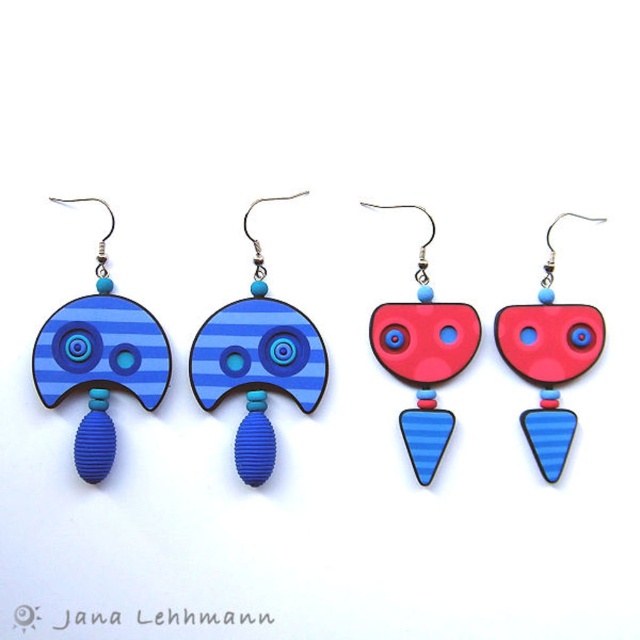
What do you see at coordinates (99, 358) in the screenshot? I see `matte blue wood earring at left` at bounding box center [99, 358].

Is point (109, 342) closer to camera compared to point (413, 381)?

That is True.

The image size is (640, 640). I want to click on matte blue wood earring at left, so click(99, 358).

Does blue striped wood at center have a lesser height compared to matte blue wood earring at center?

No.

Consider the image. Does blue striped wood at center have a greater width compared to matte blue wood earring at center?

Yes.

Locate an element on the screen. This screenshot has height=640, width=640. blue striped wood at center is located at coordinates (257, 362).

The image size is (640, 640). Identify the location of blue striped wood at center. tap(257, 362).

Does blue striped wood at center have a smaller size compared to matte red plastic heart at center?

Incorrect, blue striped wood at center is not smaller in size than matte red plastic heart at center.

Between point (241, 422) and point (545, 312), which one is positioned in front?

Point (241, 422) is more forward.

The width and height of the screenshot is (640, 640). In order to click on blue striped wood at center in this screenshot , I will do `click(257, 362)`.